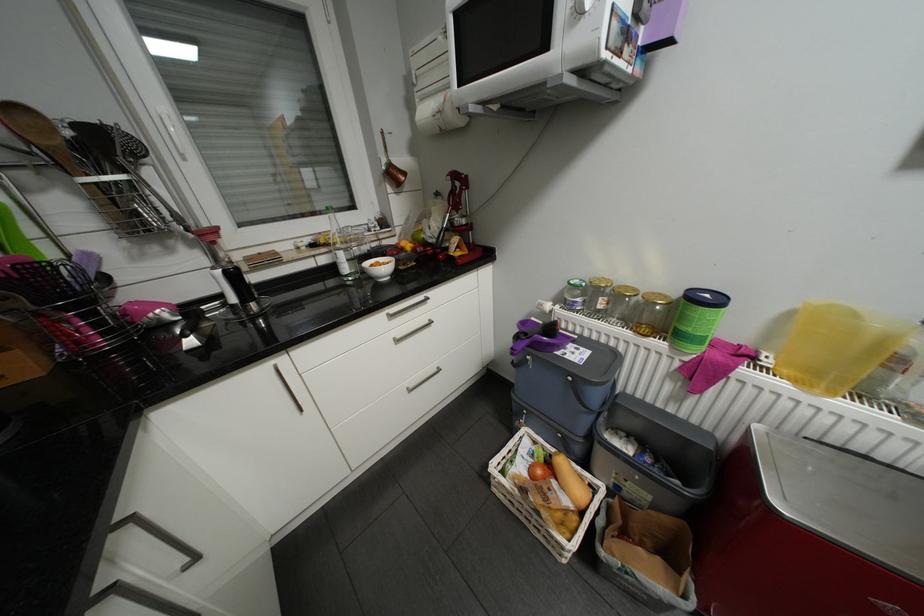
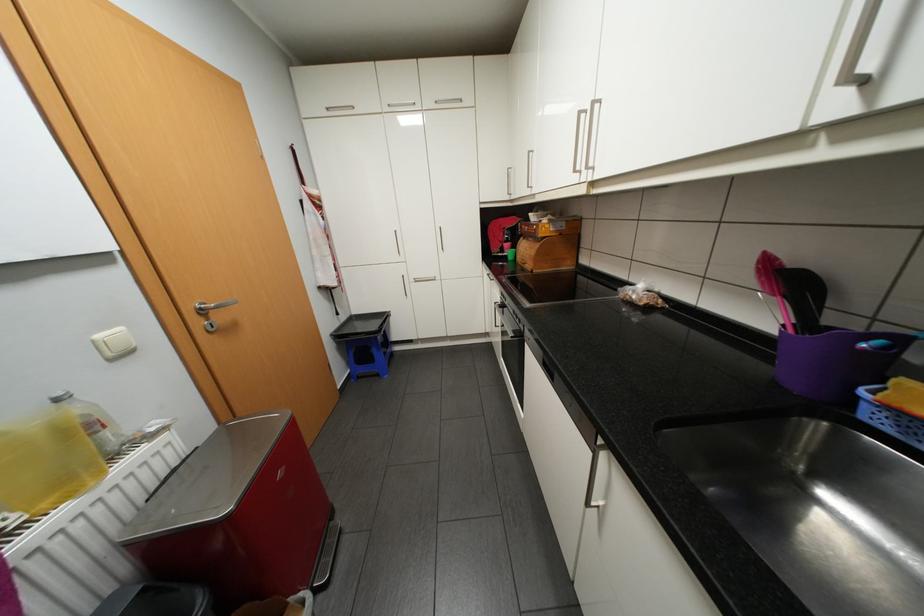
Where in the second image is the point corresponding to [794,371] from the first image?

(53, 504)